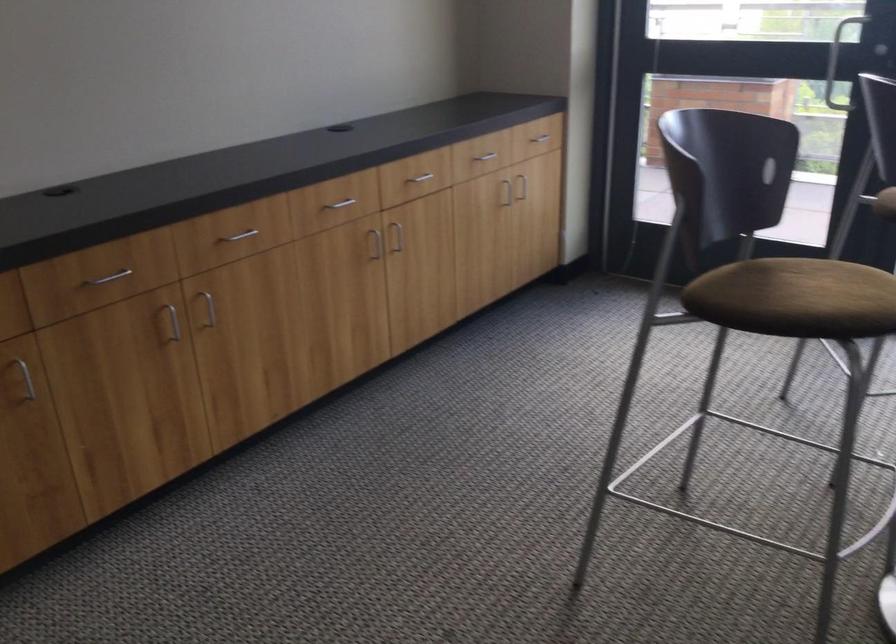
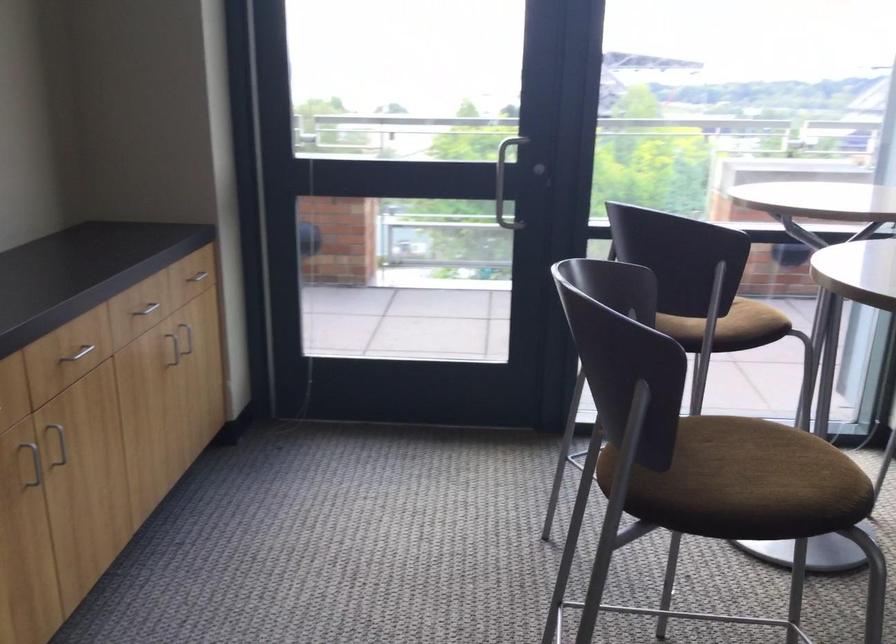
Find the pixel in the second image that matches point 373,243 in the first image.

(36, 465)